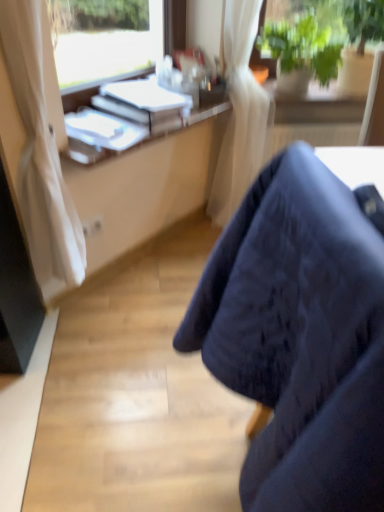
Question: From the image's perspective, is white glossy book at upper left, placed as the 1th book when sorted from bottom to top, positioned above or below white paper at upper center, which ranks as the second book in bottom-to-top order?

Choices:
 (A) below
 (B) above

Answer: (A)

Question: Considering the positions of white glossy book at upper left, arranged as the second book when viewed from the top, and white paper at upper center, which ranks as the second book in bottom-to-top order, in the image, is white glossy book at upper left, arranged as the second book when viewed from the top, taller or shorter than white paper at upper center, which ranks as the second book in bottom-to-top order,?

Choices:
 (A) short
 (B) tall

Answer: (A)

Question: Estimate the real-world distances between objects in this image. Which object is farther from the dark fabric chair at lower right?

Choices:
 (A) green leafy plant at upper right
 (B) white plastic desk at upper left
 (C) white paper at upper center, which ranks as the second book in bottom-to-top order
 (D) white glossy book at upper left, arranged as the second book when viewed from the top

Answer: (A)

Question: Which object is the closest to the dark fabric chair at lower right?

Choices:
 (A) green leafy plant at upper right
 (B) white plastic desk at upper left
 (C) white paper at upper center, which is the 1th book from top to bottom
 (D) white glossy book at upper left, placed as the 1th book when sorted from bottom to top

Answer: (D)